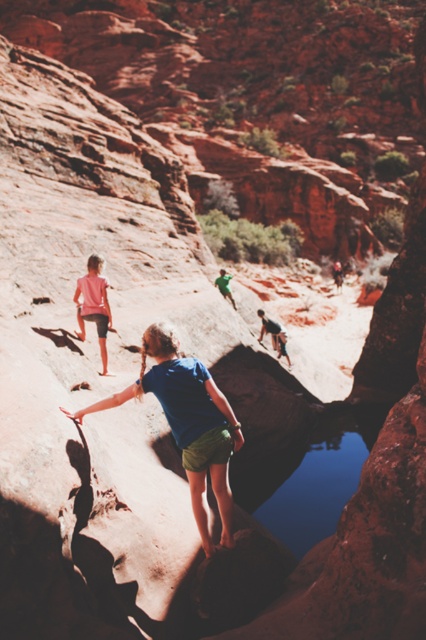
Consider the image. You are a hiker who needs to cross the canyon safely. You see a blue fabric shorts at center and a pink fabric shorts at lower left. Which direction should you move to reach the higher ground?

The blue fabric shorts at center is below the pink fabric shorts at lower left, so to reach higher ground, you should move towards the pink fabric shorts at lower left.

You are a hiker trying to cross the canyon and see the pink fabric shorts at lower left and the smooth gray rock climber at center. Which object is located to the left of the other?

The pink fabric shorts at lower left is positioned on the left side of smooth gray rock climber at center.

You are a photographer positioned at the entrance of the canyon. You want to capture both the blue fabric shorts at center and the pink fabric shorts at lower left in a single shot. Which pair of shorts will appear larger in the photo?

The blue fabric shorts at center will appear larger in the photo because they are closer to the viewer than the pink fabric shorts at lower left.